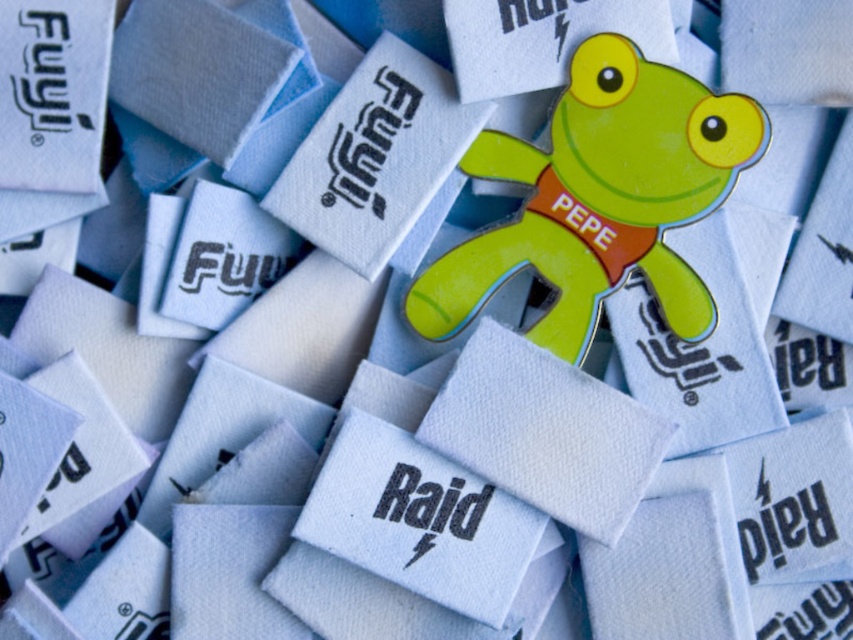
Question: Which point is farther to the camera?

Choices:
 (A) black rubber fuji at upper left
 (B) glossy plastic frog at center
 (C) black matte text at upper center

Answer: (C)

Question: Does black matte text at upper center appear on the left side of matte white text at center?

Choices:
 (A) no
 (B) yes

Answer: (A)

Question: Estimate the real-world distances between objects in this image. Which object is farther from the glossy plastic frog at center?

Choices:
 (A) black matte text at center
 (B) black matte raid at center
 (C) matte white text at center

Answer: (C)

Question: Is the position of glossy plastic frog at center more distant than that of black matte raid at center?

Choices:
 (A) no
 (B) yes

Answer: (A)

Question: Is black rubber fuji at upper left below matte white text at center?

Choices:
 (A) yes
 (B) no

Answer: (B)

Question: Which object is positioned closest to the black matte text at center?

Choices:
 (A) black matte raid at center
 (B) black matte text at upper center

Answer: (A)